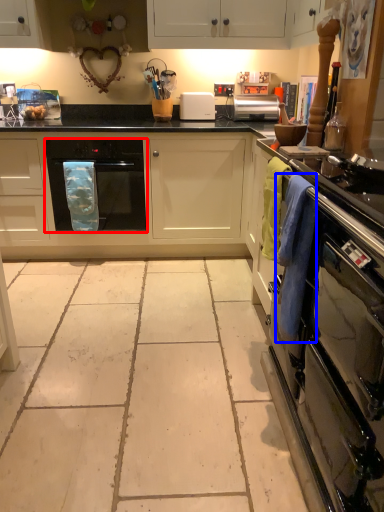
Question: Which point is further to the camera, home appliance (highlighted by a red box) or laundry (highlighted by a blue box)?

Choices:
 (A) home appliance
 (B) laundry

Answer: (A)